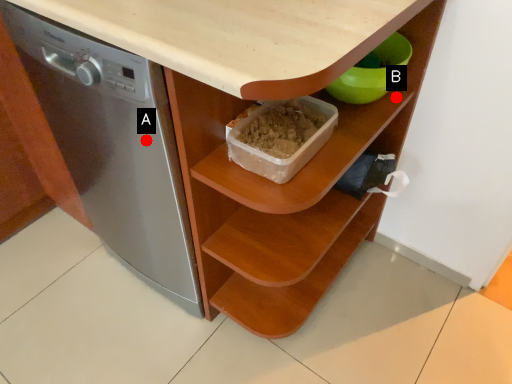
Question: Two points are circled on the image, labeled by A and B beside each circle. Which point is closer to the camera?

Choices:
 (A) A is closer
 (B) B is closer

Answer: (A)